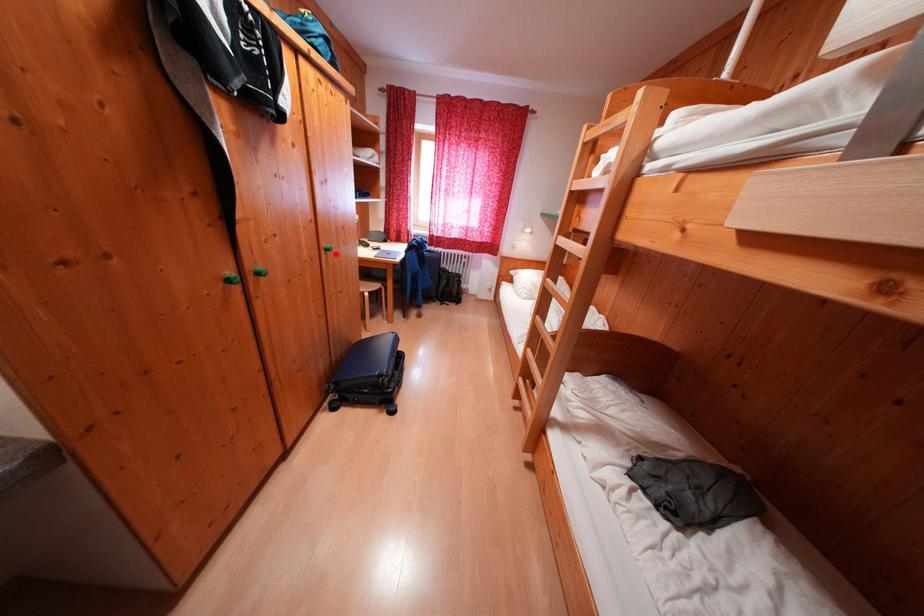
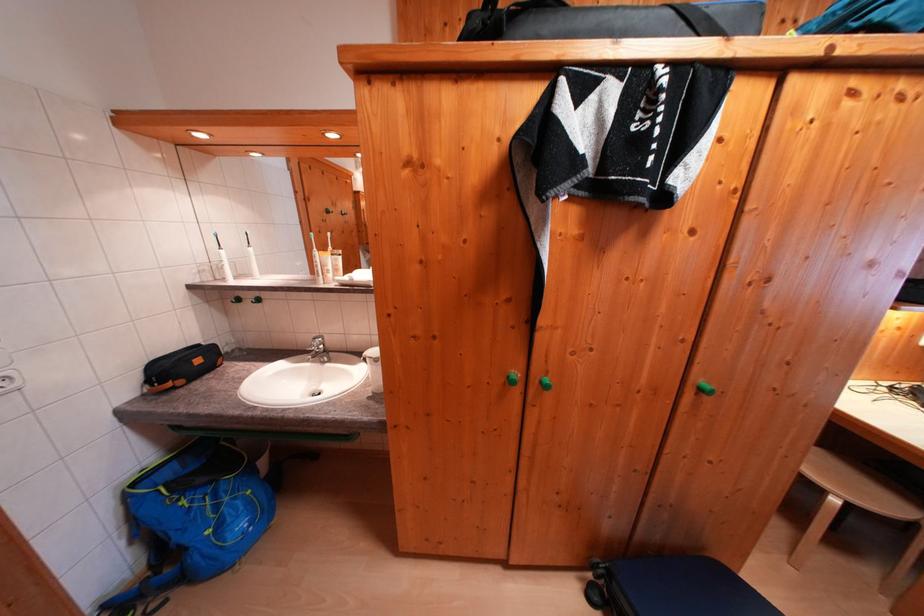
Locate, in the second image, the point that corresponds to the highlighted location in the first image.

(709, 394)